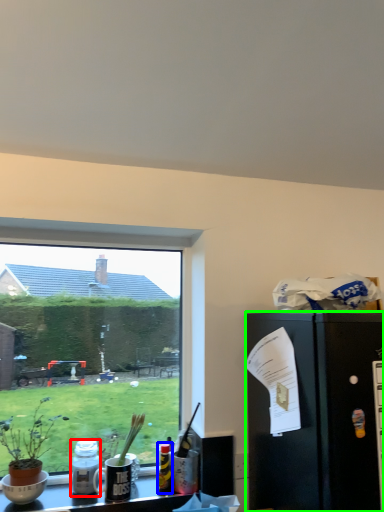
Question: Which object is the farthest from bottle (highlighted by a red box)? Choose among these: bottle (highlighted by a blue box) or refrigerator (highlighted by a green box).

Choices:
 (A) bottle
 (B) refrigerator

Answer: (B)